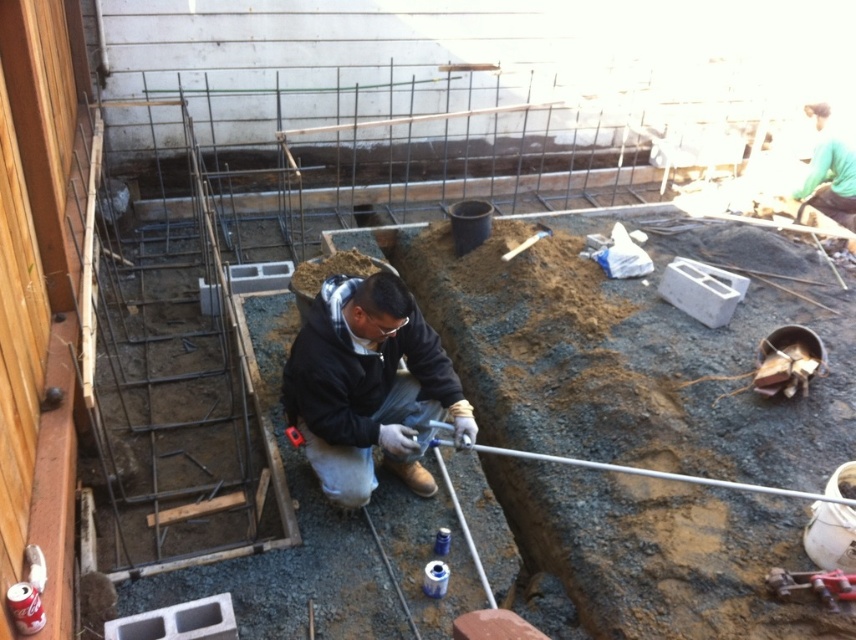
Does point (417, 429) come closer to viewer compared to point (821, 582)?

No, (417, 429) is further to viewer.

Who is shorter, black matte jacket at center or metallic red drill at lower right?

metallic red drill at lower right is shorter.

Who is more forward, (397,424) or (798,572)?

Positioned in front is point (798,572).

At what (x,y) coordinates should I click in order to perform the action: click on black matte jacket at center. Please return your answer as a coordinate pair (x, y). Looking at the image, I should click on (367, 387).

Can you confirm if black matte jacket at center is positioned above green fabric shirt at upper right?

No.

Which is more to the right, black matte jacket at center or green fabric shirt at upper right?

Positioned to the right is green fabric shirt at upper right.

Describe the element at coordinates (367, 387) in the screenshot. I see `black matte jacket at center` at that location.

Identify the location of black matte jacket at center. This screenshot has height=640, width=856. (367, 387).

Between black matte jacket at center and smooth concrete hole at center, which one appears on the right side from the viewer's perspective?

From the viewer's perspective, black matte jacket at center appears more on the right side.

Locate an element on the screen. The image size is (856, 640). black matte jacket at center is located at coordinates (x=367, y=387).

Identify the location of black matte jacket at center. pyautogui.click(x=367, y=387).